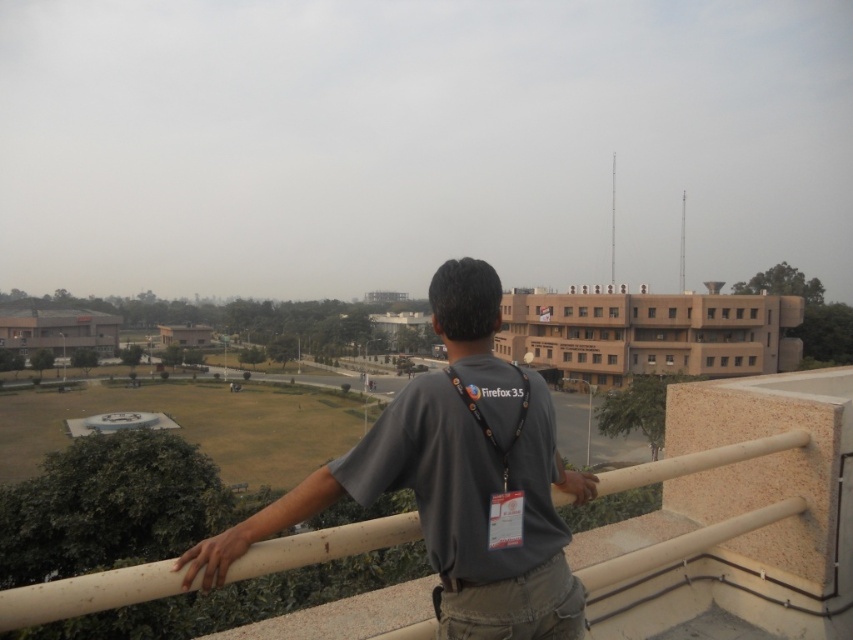
Is gray fabric shirt at center shorter than beige concrete railing at center?

In fact, gray fabric shirt at center may be taller than beige concrete railing at center.

Does point (419, 394) lie behind point (91, 586)?

Yes, point (419, 394) is behind point (91, 586).

Which is behind, point (334, 500) or point (177, 593)?

Point (334, 500)

Where is `gray fabric shirt at center`? This screenshot has height=640, width=853. gray fabric shirt at center is located at coordinates tap(454, 480).